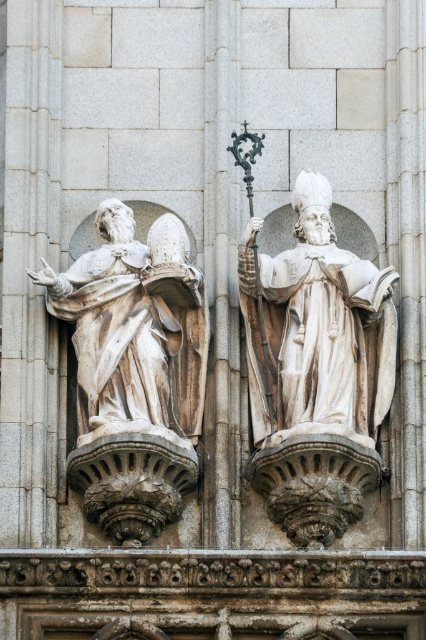
Question: Does white marble statue at left appear over smooth stone pillar at center?

Choices:
 (A) yes
 (B) no

Answer: (B)

Question: Which point is farther to the camera?

Choices:
 (A) white marble statue at left
 (B) smooth stone pillar at center

Answer: (A)

Question: Which point is farther to the camera?

Choices:
 (A) (212, 77)
 (B) (126, 394)

Answer: (A)

Question: Is white marble statue at left bigger than smooth stone pillar at center?

Choices:
 (A) yes
 (B) no

Answer: (B)

Question: Where is white marble statue at left located in relation to smooth stone pillar at center in the image?

Choices:
 (A) left
 (B) right

Answer: (A)